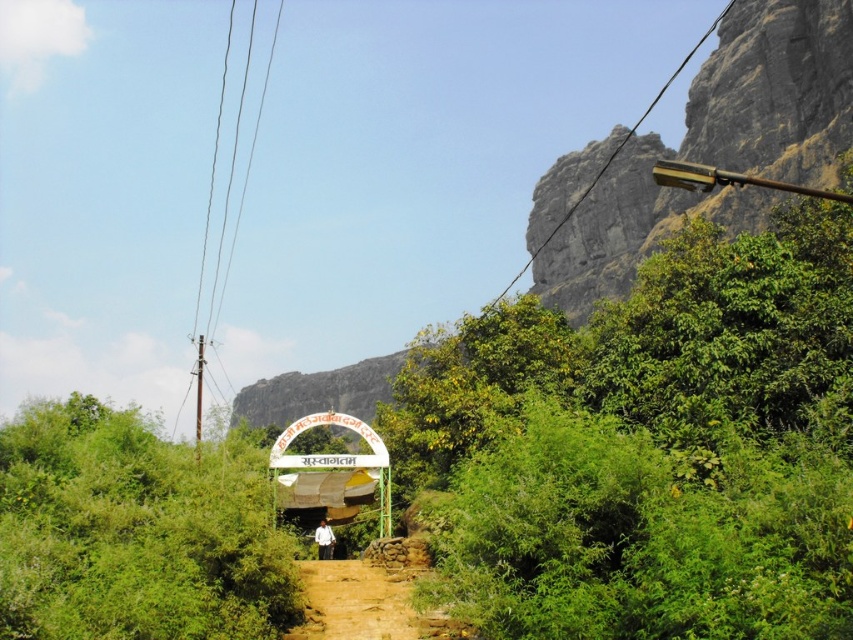
Question: Does green leafy bush at upper right appear on the left side of brown dirt track at lower center?

Choices:
 (A) yes
 (B) no

Answer: (B)

Question: From the image, what is the correct spatial relationship of green leafy bush at upper right in relation to green leafy bush at center?

Choices:
 (A) above
 (B) below

Answer: (A)

Question: Which is farther from the gray rock formation at upper center?

Choices:
 (A) brown dirt track at lower center
 (B) green leafy bush at upper right

Answer: (A)

Question: Among these points, which one is farthest from the camera?

Choices:
 (A) (590, 148)
 (B) (546, 321)

Answer: (A)

Question: Among these objects, which one is nearest to the camera?

Choices:
 (A) gray rock formation at upper center
 (B) green leafy bush at center

Answer: (B)

Question: Considering the relative positions of green leafy bush at center and brown dirt track at lower center in the image provided, where is green leafy bush at center located with respect to brown dirt track at lower center?

Choices:
 (A) right
 (B) left

Answer: (B)